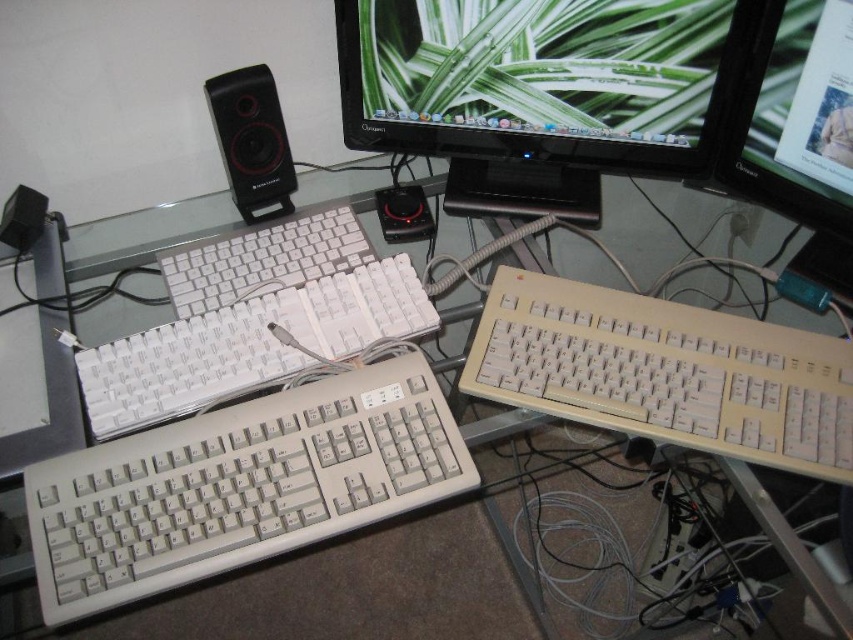
In the scene shown: Can you confirm if beige plastic keyboard at lower left is positioned to the left of white matte keyboard at center?

No, beige plastic keyboard at lower left is not to the left of white matte keyboard at center.

From the picture: How far apart are beige plastic keyboard at lower left and white matte keyboard at center?

beige plastic keyboard at lower left and white matte keyboard at center are 10.13 inches apart.

Who is more forward, (413, 456) or (363, 250)?

Point (413, 456)

Locate an element on the screen. The image size is (853, 640). beige plastic keyboard at lower left is located at coordinates (239, 484).

Which is behind, point (531, 35) or point (752, 406)?

Positioned behind is point (531, 35).

Does point (706, 92) come closer to viewer compared to point (804, 348)?

That is False.

The image size is (853, 640). What do you see at coordinates (544, 77) in the screenshot?
I see `matte plastic monitor at upper center` at bounding box center [544, 77].

Locate an element on the screen. The image size is (853, 640). matte plastic monitor at upper center is located at coordinates (544, 77).

Does beige plastic keyboard at lower left have a lesser width compared to white plastic monitor at upper right?

Incorrect, beige plastic keyboard at lower left's width is not less than white plastic monitor at upper right's.

From the picture: Which of these two, beige plastic keyboard at lower left or white plastic monitor at upper right, stands shorter?

Standing shorter between the two is beige plastic keyboard at lower left.

Describe the element at coordinates (239, 484) in the screenshot. I see `beige plastic keyboard at lower left` at that location.

Where is `beige plastic keyboard at lower left`? This screenshot has width=853, height=640. beige plastic keyboard at lower left is located at coordinates (239, 484).